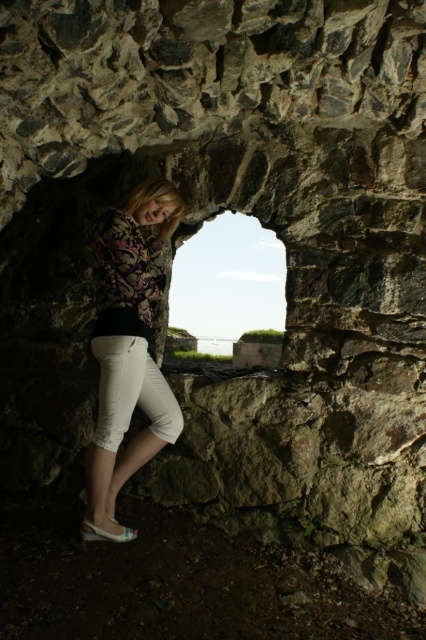
What do you see at coordinates (127, 348) in the screenshot? I see `matte floral blouse at center` at bounding box center [127, 348].

You are a GUI agent. You are given a task and a screenshot of the screen. Output one action in this format:
    pyautogui.click(x=<x>, y=<y>)
    Task: Click on the matte floral blouse at center
    The image size is (426, 640).
    Given the screenshot: What is the action you would take?
    pyautogui.click(x=127, y=348)

This screenshot has width=426, height=640. Identify the location of matte floral blouse at center. (127, 348).

Between transparent glass window at center and white cotton pants at lower left, which one has more height?

Standing taller between the two is transparent glass window at center.

Who is more distant from viewer, (255, 337) or (120, 419)?

Point (255, 337)

Locate an element on the screen. The width and height of the screenshot is (426, 640). transparent glass window at center is located at coordinates (229, 294).

Which is more to the left, matte floral blouse at center or white cotton pants at lower left?

From the viewer's perspective, white cotton pants at lower left appears more on the left side.

From the picture: Between matte floral blouse at center and white cotton pants at lower left, which one has more height?

matte floral blouse at center

Measure the distance between matte floral blouse at center and camera.

A distance of 2.88 meters exists between matte floral blouse at center and camera.

Where is `matte floral blouse at center`? matte floral blouse at center is located at coordinates (127, 348).